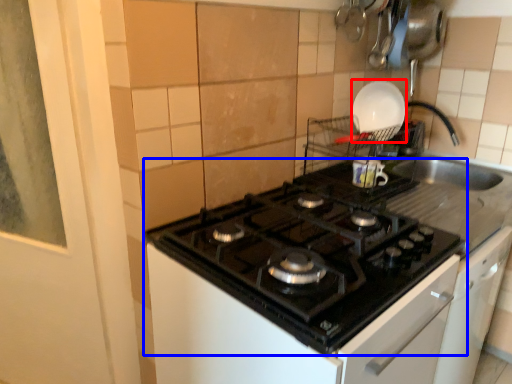
Question: Which object appears farthest to the camera in this image, kitchen appliance (highlighted by a red box) or gas stove (highlighted by a blue box)?

Choices:
 (A) kitchen appliance
 (B) gas stove

Answer: (A)